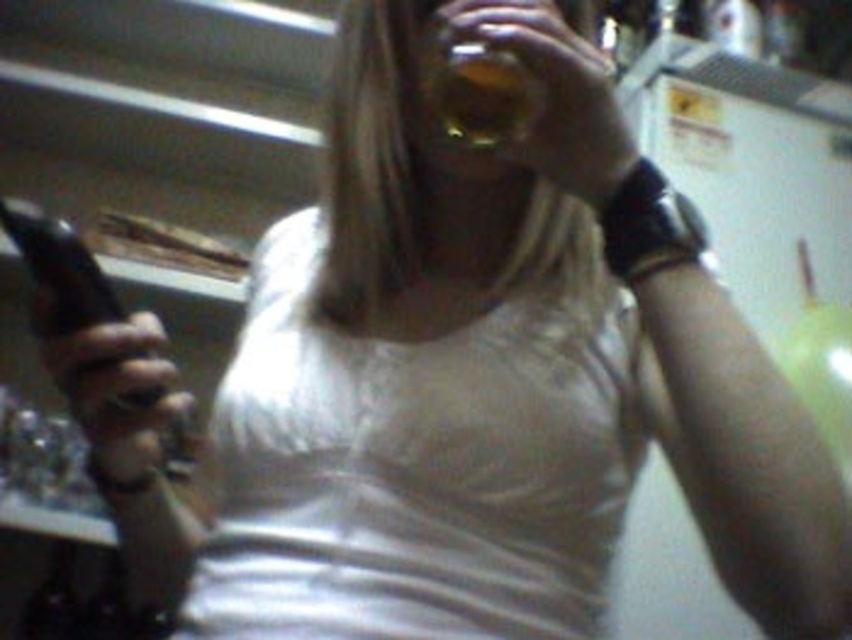
You are a photographer adjusting the camera focus. You need to focus on both the white matte tank top at center and the translucent amber liquid at upper center. Which object should you focus on first to ensure both are in focus?

You should focus on the white matte tank top at center first because it is closer to the viewer than the translucent amber liquid at upper center, allowing both to be in focus when adjusting depth of field.